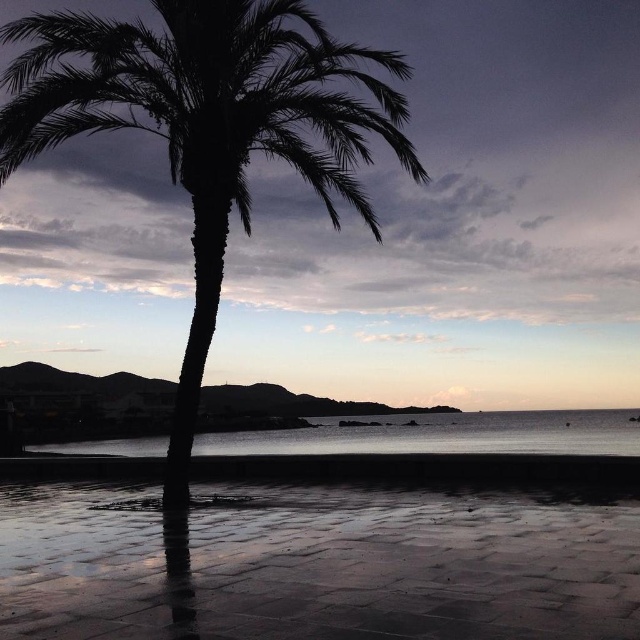
Question: From the image, what is the correct spatial relationship of silhouette leafy palm at center in relation to transparent water at center?

Choices:
 (A) left
 (B) right

Answer: (A)

Question: Among these points, which one is nearest to the camera?

Choices:
 (A) (113, 579)
 (B) (51, 115)
 (C) (506, 449)

Answer: (A)

Question: Can you confirm if reflective wet sand at lower center is bigger than transparent water at center?

Choices:
 (A) no
 (B) yes

Answer: (A)

Question: Which of the following is the closest to the observer?

Choices:
 (A) (188, 483)
 (B) (356, 592)
 (C) (125, 442)

Answer: (B)

Question: Which point appears farthest from the camera in this image?

Choices:
 (A) (237, 515)
 (B) (161, 436)

Answer: (B)

Question: Can you confirm if reflective wet sand at lower center is thinner than transparent water at center?

Choices:
 (A) yes
 (B) no

Answer: (A)